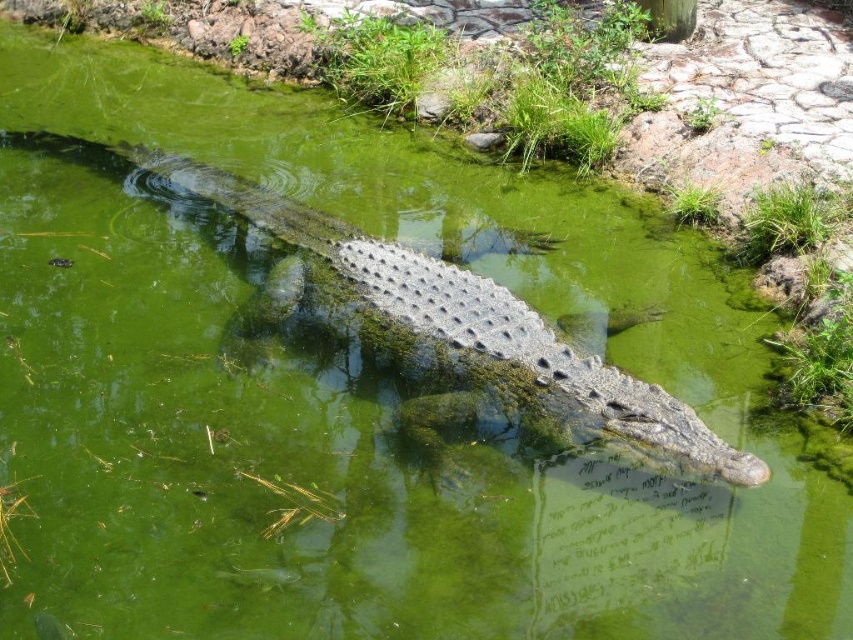
Question: Can you confirm if gray scaly crocodile at center is wider than green grass at upper right?

Choices:
 (A) yes
 (B) no

Answer: (A)

Question: Does gray scaly crocodile at center come in front of green grass at upper right?

Choices:
 (A) yes
 (B) no

Answer: (A)

Question: Which object is closer to the camera taking this photo?

Choices:
 (A) gray scaly crocodile at center
 (B) green grass at upper right

Answer: (A)

Question: Can you confirm if gray scaly crocodile at center is thinner than green grass at upper right?

Choices:
 (A) no
 (B) yes

Answer: (A)